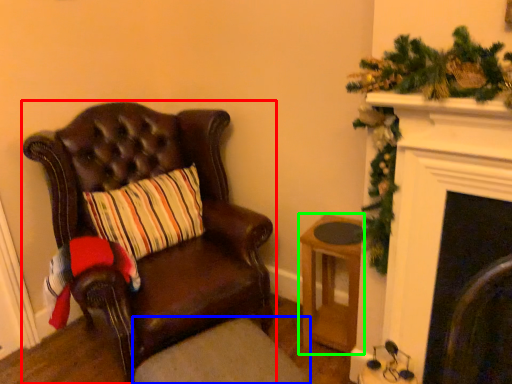
Question: Estimate the real-world distances between objects in this image. Which object is farther from chair (highlighted by a red box), footrest (highlighted by a blue box) or stool (highlighted by a green box)?

Choices:
 (A) footrest
 (B) stool

Answer: (B)